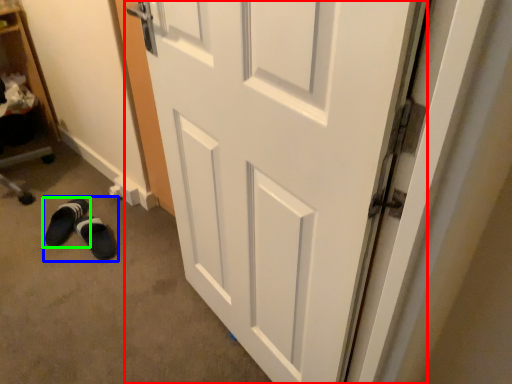
Question: Based on their relative distances, which object is farther from door (highlighted by a red box)? Choose from shoe (highlighted by a blue box) and footwear (highlighted by a green box).

Choices:
 (A) shoe
 (B) footwear

Answer: (B)